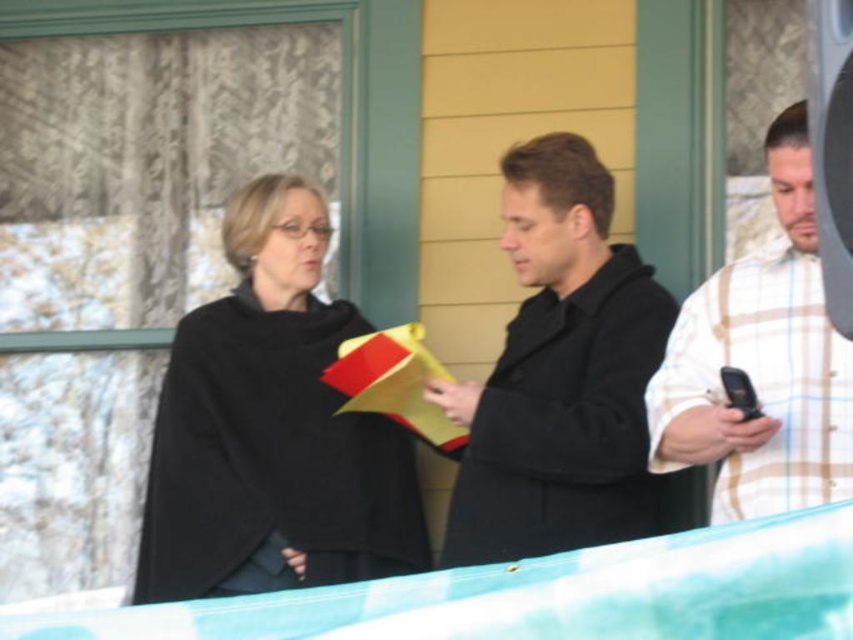
Question: Is black matte shawl at center bigger than matte black coat at center?

Choices:
 (A) no
 (B) yes

Answer: (B)

Question: Is matte black coat at center closer to camera compared to white plaid shirt at right?

Choices:
 (A) yes
 (B) no

Answer: (B)

Question: Estimate the real-world distances between objects in this image. Which object is farther from the matte black coat at center?

Choices:
 (A) black matte shawl at center
 (B) white plaid shirt at right

Answer: (A)

Question: Estimate the real-world distances between objects in this image. Which object is closer to the black matte shawl at center?

Choices:
 (A) white plaid shirt at right
 (B) matte black coat at center

Answer: (B)

Question: Which point is farther to the camera?

Choices:
 (A) white plaid shirt at right
 (B) black matte shawl at center
 (C) matte black coat at center

Answer: (B)

Question: Can you confirm if black matte shawl at center is bigger than white plaid shirt at right?

Choices:
 (A) no
 (B) yes

Answer: (B)